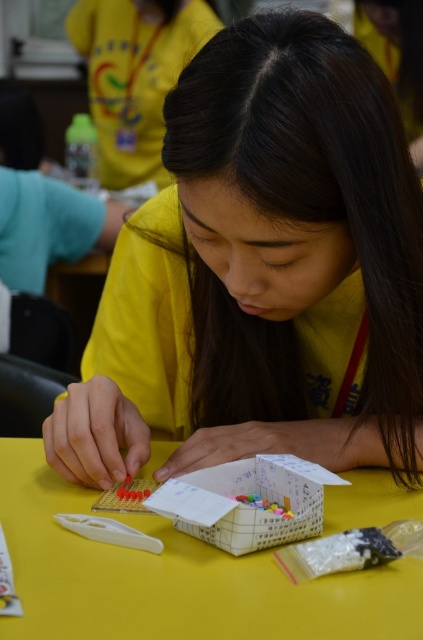
Consider the image. Does matte yellow shirt at center have a smaller size compared to yellow matte table at center?

Actually, matte yellow shirt at center might be larger than yellow matte table at center.

Does point (202, 349) come farther from viewer compared to point (208, 586)?

Yes, it is.

You are a GUI agent. You are given a task and a screenshot of the screen. Output one action in this format:
    pyautogui.click(x=<x>, y=<y>)
    Task: Click on the matte yellow shirt at center
    The image size is (423, 640).
    Given the screenshot: What is the action you would take?
    pyautogui.click(x=261, y=272)